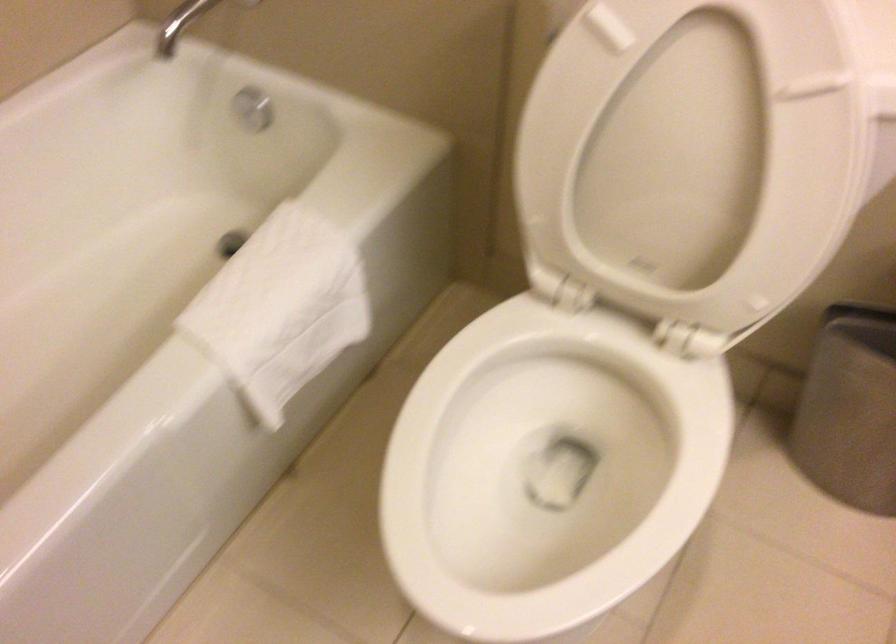
The width and height of the screenshot is (896, 644). Find the location of `white toilet seat`. white toilet seat is located at coordinates (547, 469).